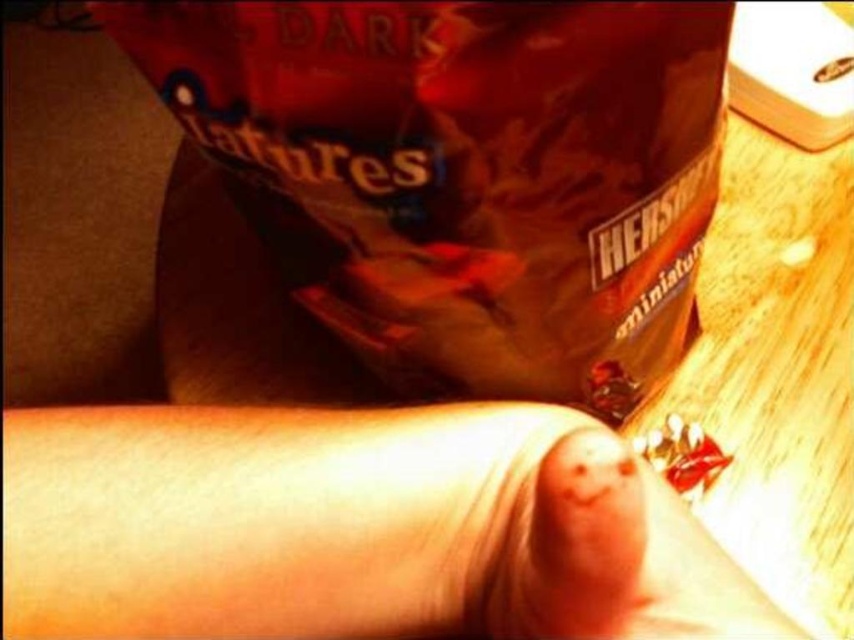
You are a photographer adjusting the lighting in the studio. You notice two areas of smooth skin in the image. The first is the smooth skin finger at lower center and the second is the smooth skin at center. From the photographer perspective, which area is positioned to the left?

The smooth skin finger at lower center is positioned to the left of the smooth skin at center.

You are a photographer who wants to ensure the brown matte bag at upper center and the smooth skin at center are both in focus. Based on their positions, which object should you adjust your camera focus to prioritize to capture both clearly?

The brown matte bag at upper center is much taller than the smooth skin at center, so adjusting focus to the brown matte bag at upper center will help ensure both are in focus as it is the taller object.